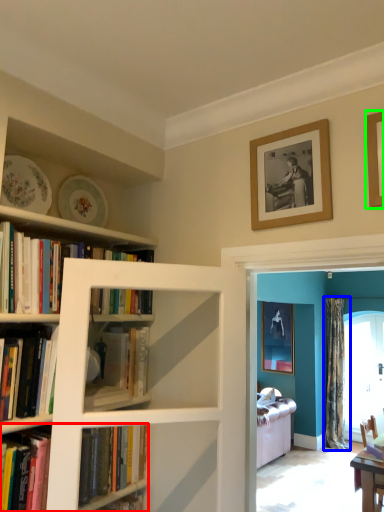
Question: Which is nearer to the book (highlighted by a red box)? curtain (highlighted by a blue box) or picture frame (highlighted by a green box).

Choices:
 (A) curtain
 (B) picture frame

Answer: (B)